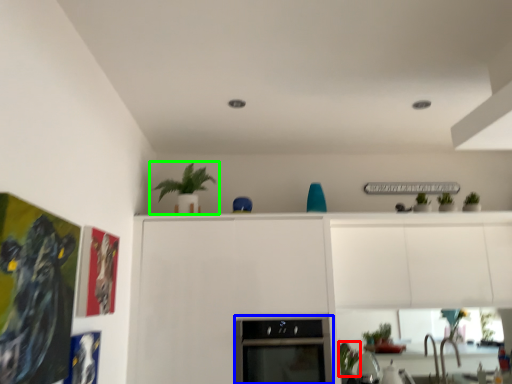
Question: Based on their relative distances, which object is nearer to plant (highlighted by a red box)? Choose from oven (highlighted by a blue box) and houseplant (highlighted by a green box).

Choices:
 (A) oven
 (B) houseplant

Answer: (A)